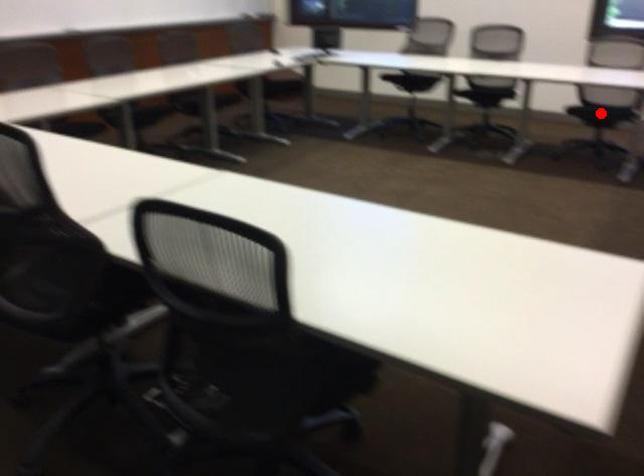
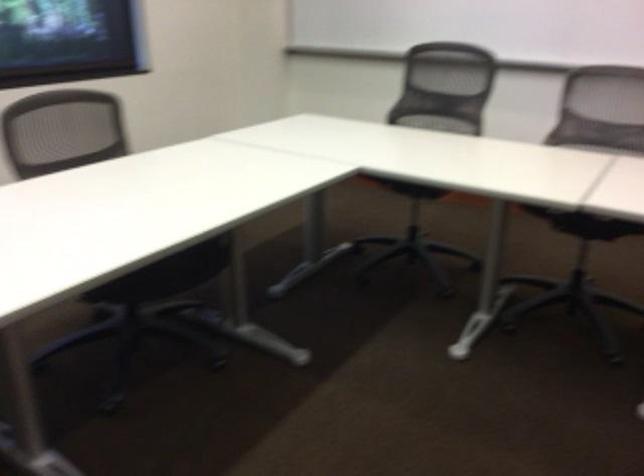
Question: I am providing you with two images of the same scene from different viewpoints. A red point is marked on the first image. At the location where the point appears in image 1, is it still visible in image 2?

Choices:
 (A) Yes
 (B) No

Answer: (B)